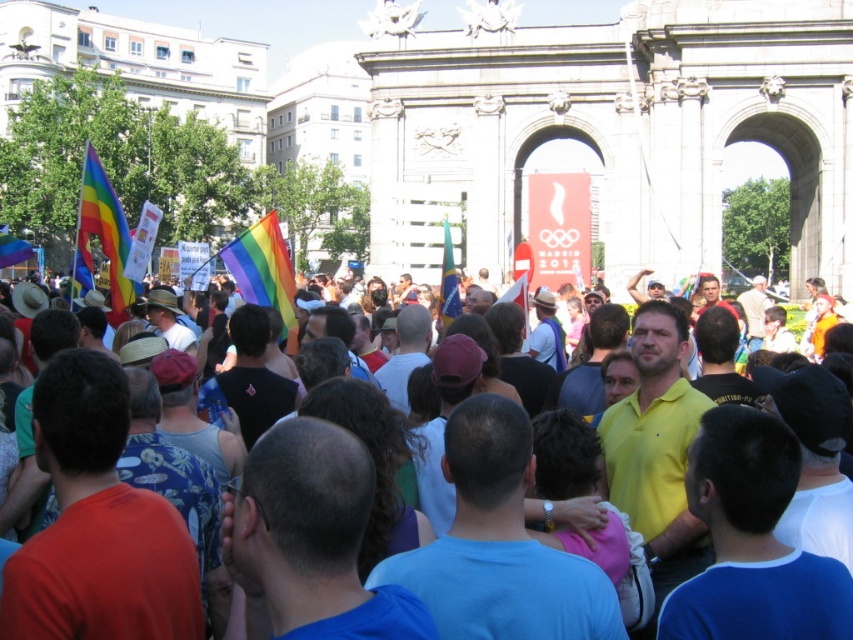
Question: Does rainbow fabric flag at center come behind blue fabric flag at center?

Choices:
 (A) no
 (B) yes

Answer: (A)

Question: Does blue fabric flag at center lie behind rainbow fabric flag at upper left?

Choices:
 (A) no
 (B) yes

Answer: (A)

Question: Which object appears farthest from the camera in this image?

Choices:
 (A) rainbow fabric flag at center
 (B) rainbow fabric flag at left
 (C) blue fabric flag at center

Answer: (B)

Question: Which object appears closest to the camera in this image?

Choices:
 (A) blue fabric flag at center
 (B) rainbow fabric flag at center
 (C) rainbow fabric flag at left

Answer: (B)

Question: Which object is positioned farthest from the blue fabric flag at center?

Choices:
 (A) rainbow fabric flag at left
 (B) rainbow fabric flag at center
 (C) matte yellow shirt at center
 (D) rainbow fabric flag at upper left

Answer: (D)

Question: Is blue fabric flag at center above rainbow fabric flag at upper left?

Choices:
 (A) no
 (B) yes

Answer: (A)